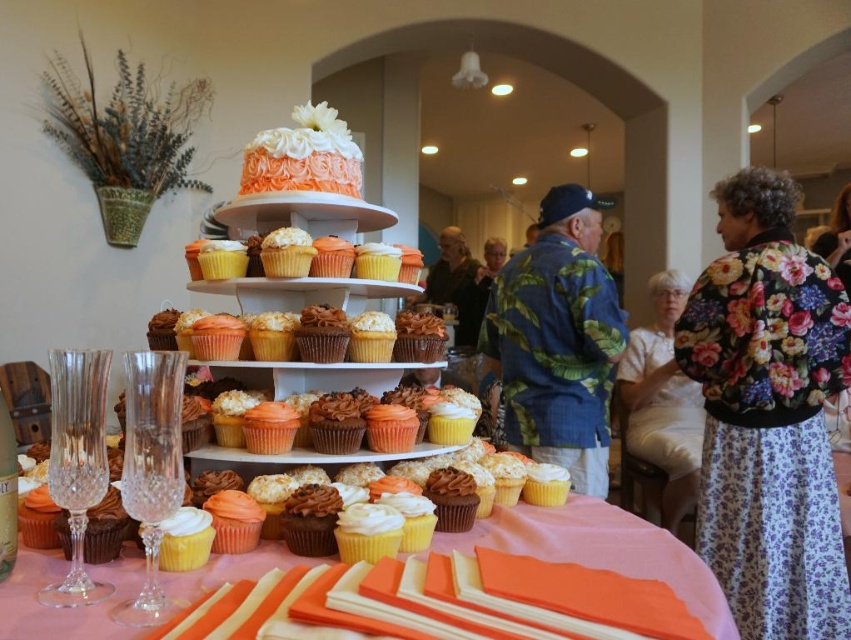
Question: Is orange frosting cupcake at center in front of orange frosted cupcake at center?

Choices:
 (A) no
 (B) yes

Answer: (B)

Question: Can you confirm if floral fabric jacket at right is positioned above orange frosting cupcake at center?

Choices:
 (A) yes
 (B) no

Answer: (A)

Question: Which object is positioned farthest from the white floral dress at lower right?

Choices:
 (A) orange frosting cupcake at center
 (B) floral fabric jacket at right
 (C) yellow frosted cupcake at center

Answer: (A)

Question: Estimate the real-world distances between objects in this image. Which object is closer to the orange frosted cupcake at center?

Choices:
 (A) crystal clear wine glass at lower left
 (B) orange frosting cupcake at center
 (C) white frosted cupcake at center
 (D) dark brown leather jacket at center

Answer: (B)

Question: Does white floral dress at lower right appear under white frosted cupcake at center?

Choices:
 (A) no
 (B) yes

Answer: (B)

Question: Which point is farther from the camera taking this photo?

Choices:
 (A) (660, 353)
 (B) (166, 598)
 (C) (334, 138)

Answer: (A)